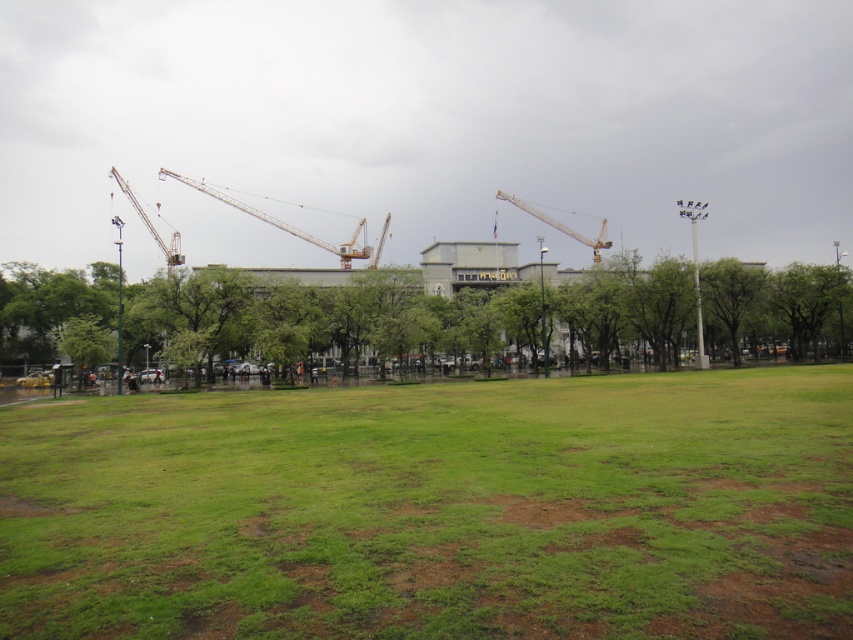
Between metallic yellow crane at center and metallic yellow crane at left, which one appears on the left side from the viewer's perspective?

metallic yellow crane at left is more to the left.

This screenshot has width=853, height=640. I want to click on metallic yellow crane at center, so click(x=561, y=225).

The image size is (853, 640). I want to click on metallic yellow crane at center, so click(x=561, y=225).

Does yellow metallic crane at center have a lesser width compared to metallic yellow crane at center?

No, yellow metallic crane at center is not thinner than metallic yellow crane at center.

Between yellow metallic crane at center and metallic yellow crane at center, which one appears on the left side from the viewer's perspective?

yellow metallic crane at center is more to the left.

The image size is (853, 640). What do you see at coordinates (283, 221) in the screenshot?
I see `yellow metallic crane at center` at bounding box center [283, 221].

The image size is (853, 640). What are the coordinates of `yellow metallic crane at center` in the screenshot? It's located at (283, 221).

Measure the distance between green leafy tree at center and yellow metallic crane at center.

green leafy tree at center and yellow metallic crane at center are 158.08 feet apart.

In the scene shown: Can you confirm if green leafy tree at center is positioned to the right of yellow metallic crane at center?

Indeed, green leafy tree at center is positioned on the right side of yellow metallic crane at center.

Between point (474, 320) and point (238, 204), which one is positioned in front?

Point (474, 320) is in front.

The width and height of the screenshot is (853, 640). Find the location of `green leafy tree at center`. green leafy tree at center is located at coordinates (345, 316).